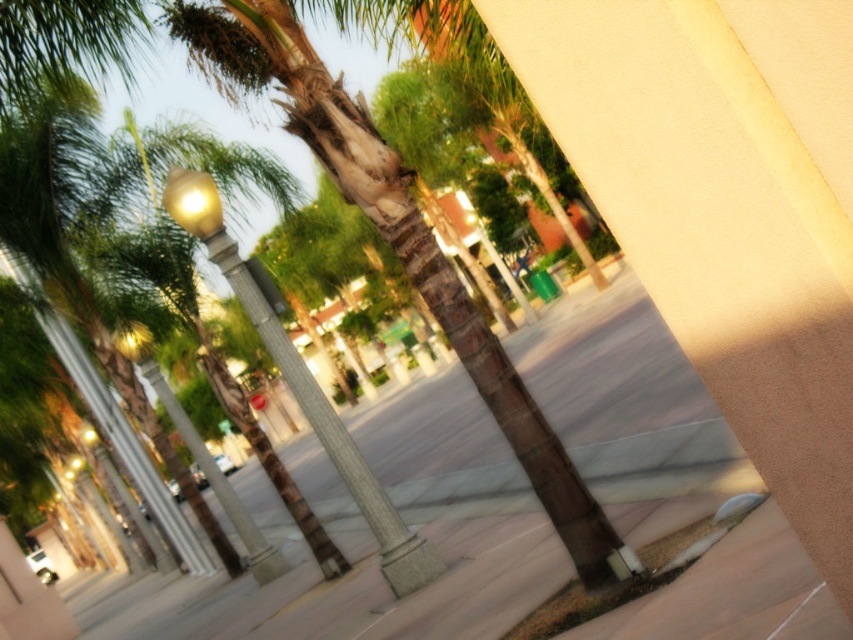
Question: Is smooth concrete pavement at center further to camera compared to green textured palm tree at center?

Choices:
 (A) yes
 (B) no

Answer: (A)

Question: Can you confirm if smooth concrete pavement at center is positioned below green textured palm tree at center?

Choices:
 (A) yes
 (B) no

Answer: (A)

Question: Which object appears closest to the camera in this image?

Choices:
 (A) smooth concrete pavement at center
 (B) matte gold lamp post at left

Answer: (A)

Question: Among these points, which one is nearest to the camera?

Choices:
 (A) coord(183,589)
 (B) coord(311,380)

Answer: (B)

Question: Which of these objects is positioned closest to the matte gold lamp post at left?

Choices:
 (A) green textured palm tree at center
 (B) smooth concrete pavement at center

Answer: (A)

Question: Considering the relative positions of smooth concrete pavement at center and matte gold lamp post at left in the image provided, where is smooth concrete pavement at center located with respect to matte gold lamp post at left?

Choices:
 (A) right
 (B) left

Answer: (A)